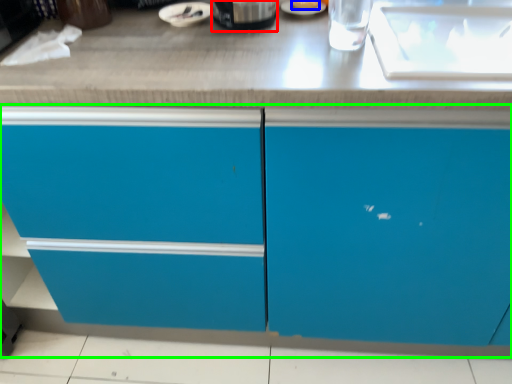
Question: Which object is positioned farthest from appliance (highlighted by a red box)? Select from food (highlighted by a blue box) and cabinetry (highlighted by a green box).

Choices:
 (A) food
 (B) cabinetry

Answer: (B)